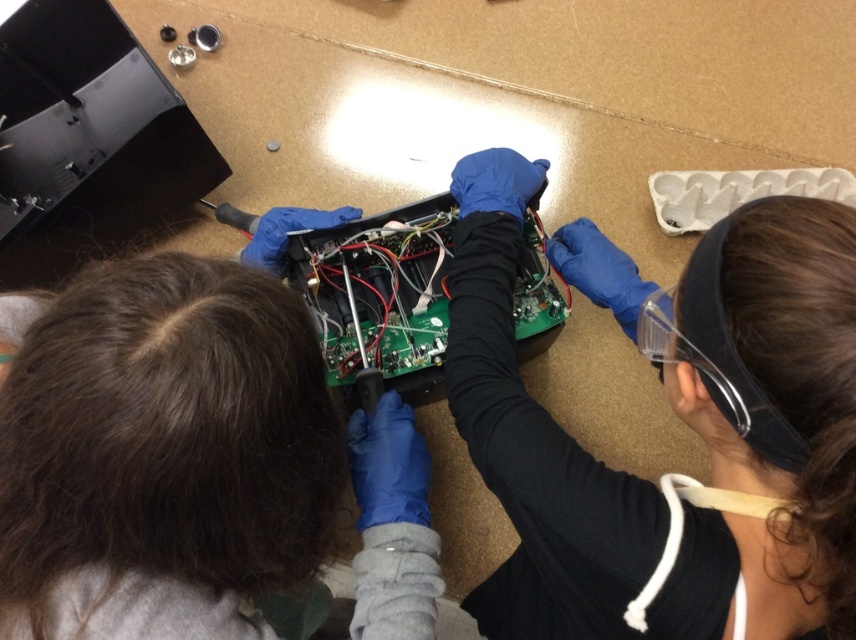
Question: Which object is closer to the camera taking this photo?

Choices:
 (A) green circuit board at center
 (B) matte black circuit board at center

Answer: (B)

Question: From the image, what is the correct spatial relationship of matte black circuit board at center in relation to green circuit board at center?

Choices:
 (A) right
 (B) left

Answer: (A)

Question: Can you confirm if matte black circuit board at center is positioned above green circuit board at center?

Choices:
 (A) no
 (B) yes

Answer: (A)

Question: Which point is closer to the camera?

Choices:
 (A) green circuit board at center
 (B) matte black circuit board at center

Answer: (B)

Question: Does matte black circuit board at center have a smaller size compared to green circuit board at center?

Choices:
 (A) yes
 (B) no

Answer: (B)